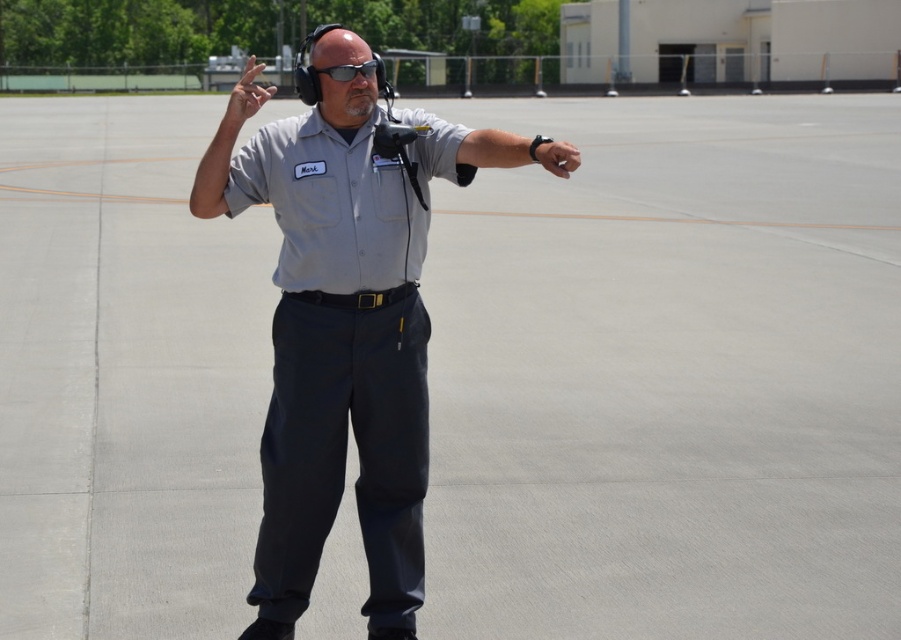
Question: From the image, what is the correct spatial relationship of gray fabric arm at upper center in relation to matte black watch at center?

Choices:
 (A) below
 (B) above

Answer: (B)

Question: Does gray fabric shirt at center have a larger size compared to black matte watch at center?

Choices:
 (A) no
 (B) yes

Answer: (B)

Question: Which point is closer to the camera taking this photo?

Choices:
 (A) (563, 173)
 (B) (217, 145)
 (C) (329, 104)
 (D) (363, 68)

Answer: (A)

Question: From the image, what is the correct spatial relationship of black matte watch at center in relation to gray fabric arm at upper center?

Choices:
 (A) right
 (B) left

Answer: (A)

Question: Which point is farther from the camera taking this photo?

Choices:
 (A) (351, 65)
 (B) (232, 97)

Answer: (A)

Question: Which of these objects is positioned closest to the matte black watch at center?

Choices:
 (A) gray fabric arm at upper center
 (B) matte black goggles at center
 (C) black matte watch at center
 (D) gray fabric shirt at center

Answer: (C)